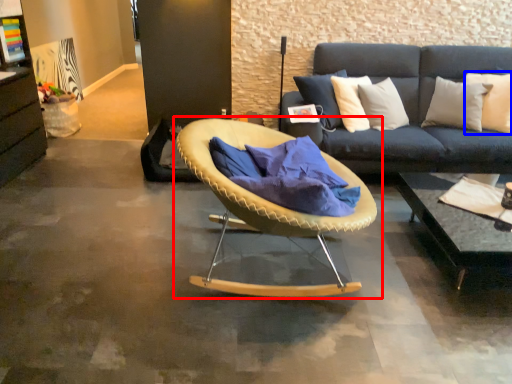
Question: Which object appears farthest to the camera in this image, chair (highlighted by a red box) or pillow (highlighted by a blue box)?

Choices:
 (A) chair
 (B) pillow

Answer: (B)